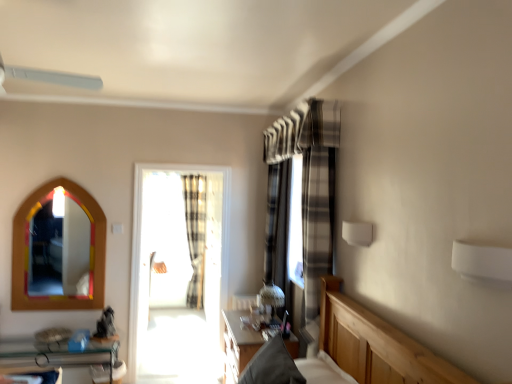
Identify the location of free space above translucent glass window at center (from a real-world perspective). Image resolution: width=512 pixels, height=384 pixels. (184, 170).